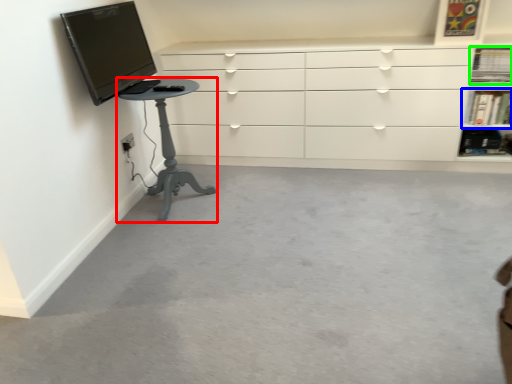
Question: Which is farther away from furniture (highlighted by a red box)? shelf (highlighted by a blue box) or shelf (highlighted by a green box)?

Choices:
 (A) shelf
 (B) shelf

Answer: (B)